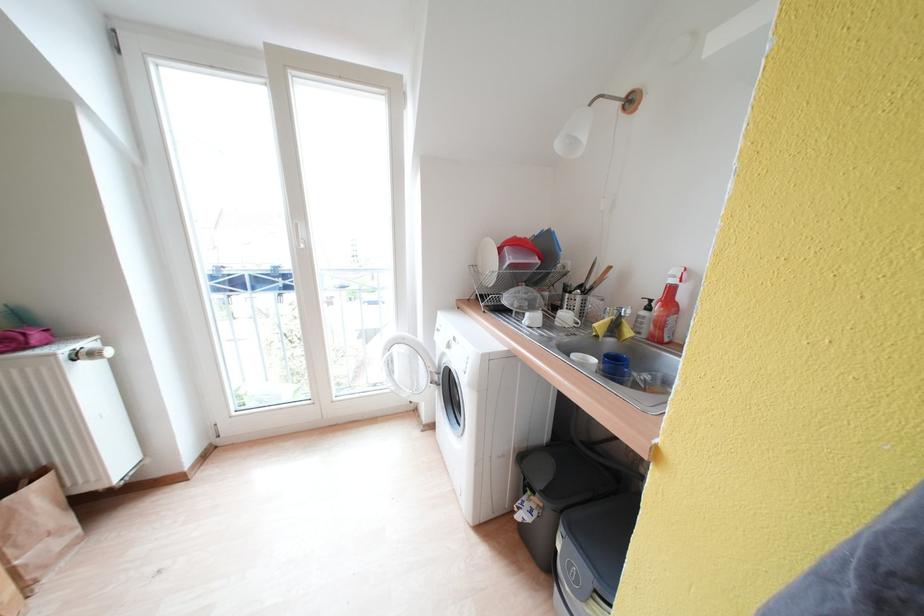
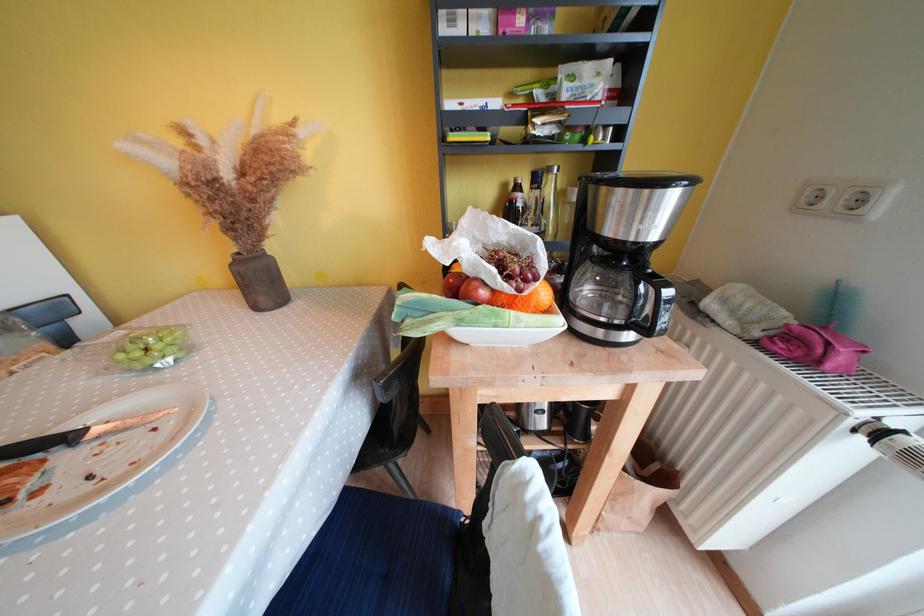
In the scene shown: The first image is from the beginning of the video and the second image is from the end. How did the camera likely rotate when shooting the video?

The camera's rotation is toward left-down.